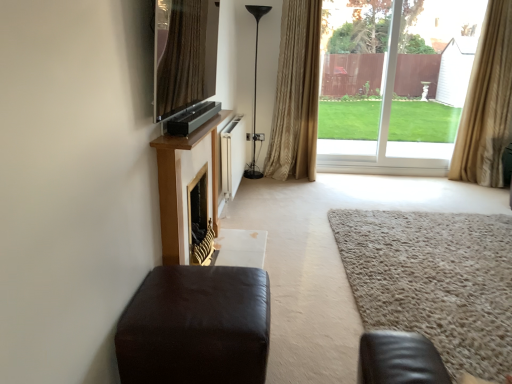
Question: Considering the relative sizes of beige fabric curtain at right, the 1th curtain positioned from the right, and matte black tv at upper center in the image provided, is beige fabric curtain at right, the 1th curtain positioned from the right, wider than matte black tv at upper center?

Choices:
 (A) no
 (B) yes

Answer: (B)

Question: Is beige fabric curtain at right, the 1th curtain positioned from the right, to the left of matte black tv at upper center from the viewer's perspective?

Choices:
 (A) yes
 (B) no

Answer: (B)

Question: Considering the relative sizes of beige fabric curtain at right, the 1th curtain positioned from the right, and matte black tv at upper center in the image provided, is beige fabric curtain at right, the 1th curtain positioned from the right, thinner than matte black tv at upper center?

Choices:
 (A) yes
 (B) no

Answer: (B)

Question: Is the position of beige fabric curtain at right, the 1th curtain positioned from the right, less distant than that of matte black tv at upper center?

Choices:
 (A) yes
 (B) no

Answer: (B)

Question: From a real-world perspective, is beige fabric curtain at right, the 1th curtain positioned from the right, below matte black tv at upper center?

Choices:
 (A) no
 (B) yes

Answer: (B)

Question: Is matte black tv at upper center inside or outside of transparent glass door at upper right?

Choices:
 (A) inside
 (B) outside

Answer: (B)

Question: Relative to transparent glass door at upper right, is matte black tv at upper center in front or behind?

Choices:
 (A) behind
 (B) front

Answer: (B)

Question: Is point (215, 59) positioned closer to the camera than point (344, 155)?

Choices:
 (A) closer
 (B) farther

Answer: (A)

Question: From the image's perspective, is matte black tv at upper center located above or below transparent glass door at upper right?

Choices:
 (A) below
 (B) above

Answer: (A)

Question: Is point (284, 135) closer or farther from the camera than point (497, 317)?

Choices:
 (A) farther
 (B) closer

Answer: (A)

Question: Looking at the image, does gold textured curtain at center, arranged as the 2th curtain when viewed from the right, seem bigger or smaller compared to beige shaggy carpet at lower right?

Choices:
 (A) small
 (B) big

Answer: (B)

Question: In terms of width, does gold textured curtain at center, which is the 1th curtain from left to right, look wider or thinner when compared to beige shaggy carpet at lower right?

Choices:
 (A) wide
 (B) thin

Answer: (B)

Question: Would you say gold textured curtain at center, arranged as the 2th curtain when viewed from the right, is inside or outside beige shaggy carpet at lower right?

Choices:
 (A) inside
 (B) outside

Answer: (B)

Question: From the image's perspective, is beige shaggy carpet at lower right located above or below gold textured curtain at center, arranged as the 2th curtain when viewed from the right?

Choices:
 (A) below
 (B) above

Answer: (A)

Question: Is beige shaggy carpet at lower right situated inside gold textured curtain at center, arranged as the 2th curtain when viewed from the right, or outside?

Choices:
 (A) inside
 (B) outside

Answer: (B)